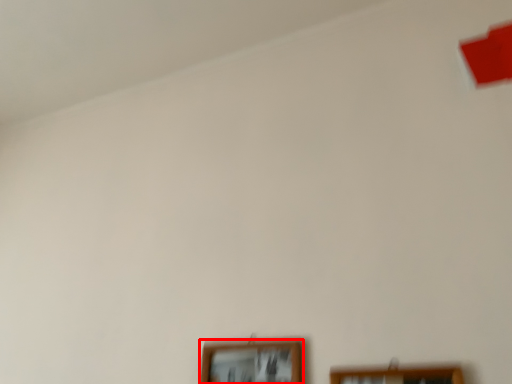
Question: From the image's perspective, where is picture frame (annotated by the red box) located in relation to picture frame in the image?

Choices:
 (A) above
 (B) below

Answer: (B)